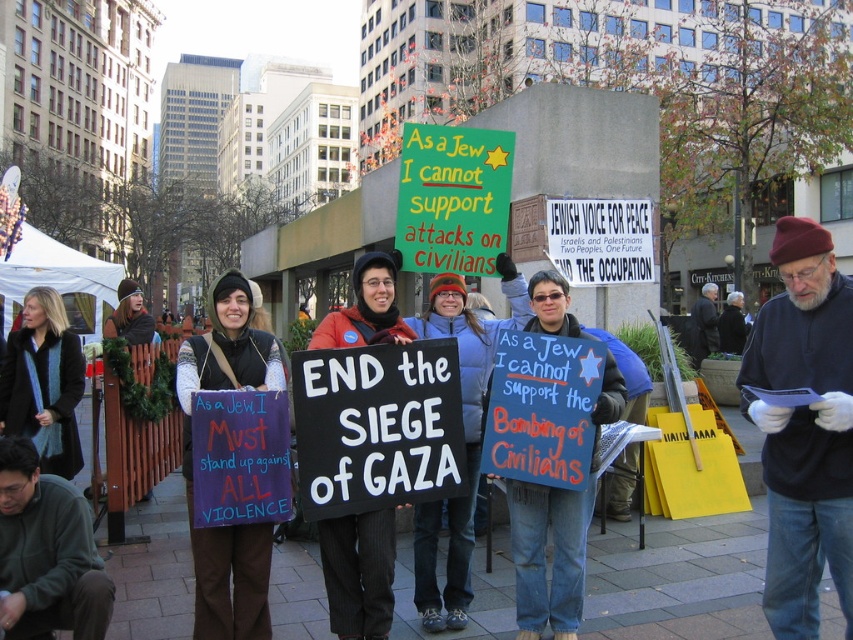
How distant is purple fabric sign at center from blue fabric sign at center?

The distance of purple fabric sign at center from blue fabric sign at center is 1.77 meters.

Is purple fabric sign at center taller than blue fabric sign at center?

No.

Measure the distance between point (187, 378) and camera.

Point (187, 378) is 14.44 feet away from camera.

You are a GUI agent. You are given a task and a screenshot of the screen. Output one action in this format:
    pyautogui.click(x=<x>, y=<y>)
    Task: Click on the purple fabric sign at center
    
    Given the screenshot: What is the action you would take?
    pyautogui.click(x=192, y=458)

Between point (251, 524) and point (374, 566), which one is positioned behind?

Positioned behind is point (374, 566).

Is point (263, 348) positioned behind point (352, 273)?

No, it is in front of (352, 273).

Locate an element on the screen. The image size is (853, 640). purple fabric sign at center is located at coordinates (192, 458).

I want to click on purple fabric sign at center, so click(x=192, y=458).

Between dark blue sweater at center and blue fabric sign at center, which one is positioned higher?

dark blue sweater at center

Which is more to the right, dark blue sweater at center or blue fabric sign at center?

Positioned to the right is dark blue sweater at center.

Is point (822, 556) closer to viewer compared to point (532, 500)?

Yes, point (822, 556) is in front of point (532, 500).

The width and height of the screenshot is (853, 640). Find the location of `dark blue sweater at center`. dark blue sweater at center is located at coordinates (804, 428).